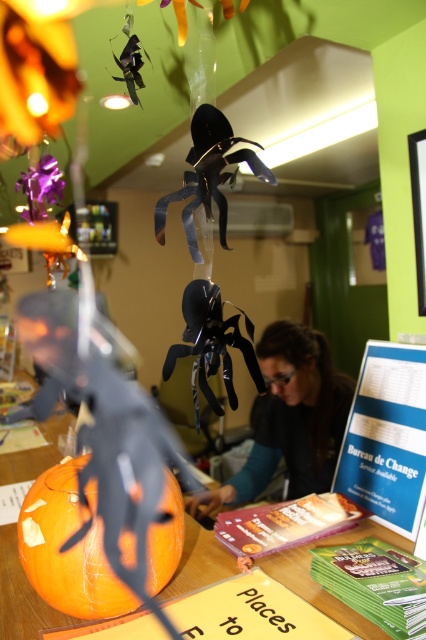
Question: Does matte black spider at center appear on the left side of orange carved pumpkin at center?

Choices:
 (A) no
 (B) yes

Answer: (A)

Question: Is orange matte pumpkin at center below orange carved pumpkin at center?

Choices:
 (A) no
 (B) yes

Answer: (A)

Question: Can you confirm if orange matte pumpkin at center is positioned to the left of orange carved pumpkin at center?

Choices:
 (A) no
 (B) yes

Answer: (B)

Question: Which object appears farthest from the camera in this image?

Choices:
 (A) matte black spider at center
 (B) orange carved pumpkin at center
 (C) orange matte pumpkin at center

Answer: (A)

Question: Which point appears closest to the camera in this image?

Choices:
 (A) (25, 536)
 (B) (28, 593)
 (C) (259, 484)

Answer: (A)

Question: Which point is closer to the camera taking this photo?

Choices:
 (A) (373, 634)
 (B) (152, 586)
 (C) (244, 496)

Answer: (A)